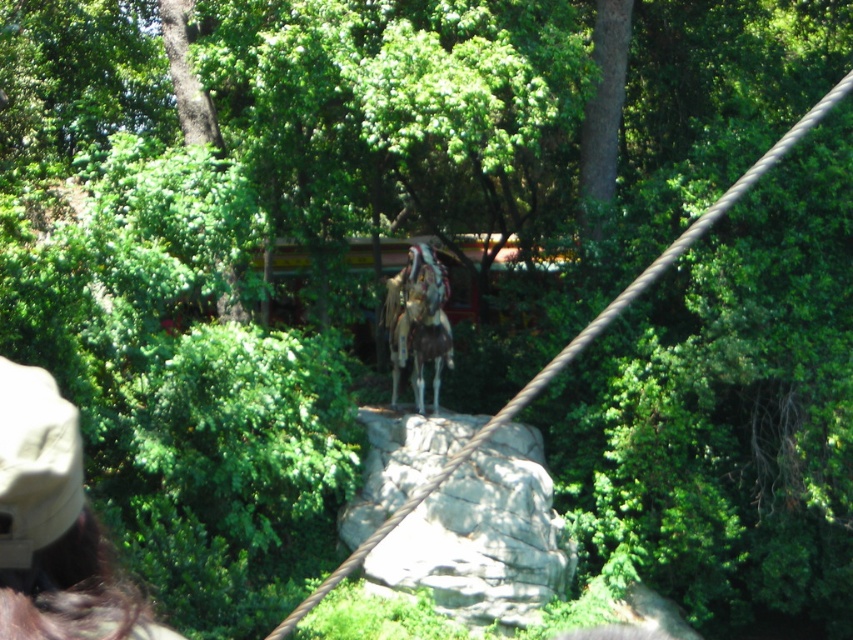
You are standing at the bottom of the forest looking up at the scene. Where is the gray rough rock at center located in terms of its 2D coordinates?

The gray rough rock at center is located at the 2D coordinates of point (x=485, y=536).

You are a photographer holding a camera at your side. You want to take a photo of the brown fabric cap at lower left without moving your body. Can you reach the cap with your hand to adjust it before taking the photo?

The distance between the brown fabric cap at lower left and the camera is 1.93 meters. Since the average human arm length is about 0.7 meters, you cannot reach the brown fabric cap at lower left to adjust it without moving your body.

You are a hiker who just entered the forest and see the gray rough rock at center and the brown fabric cap at lower left. Which object is closer to you?

The gray rough rock at center is closer to you because the brown fabric cap at lower left is behind it.